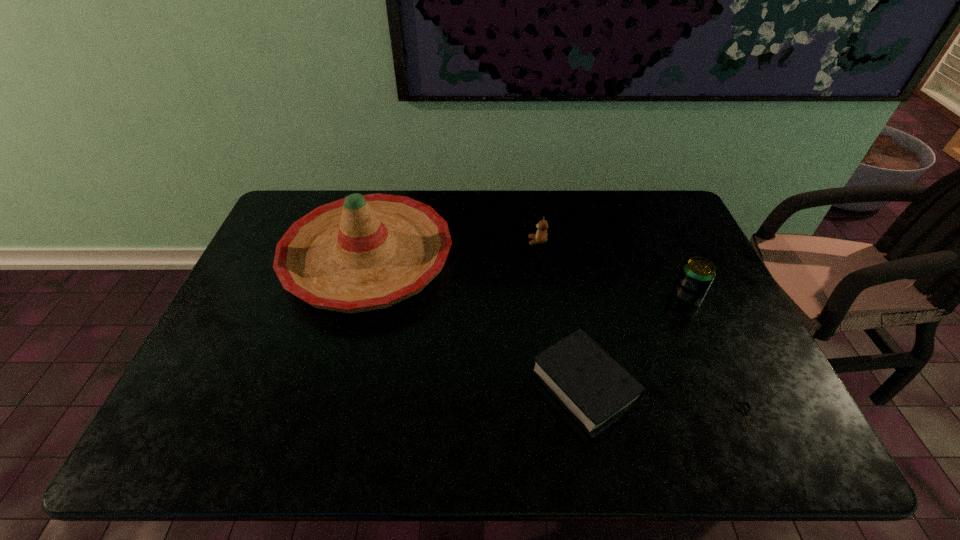
The height and width of the screenshot is (540, 960). I want to click on object that is at the near right corner, so click(x=745, y=411).

In the image, there is a desktop. Where is `vacant space at the far edge`? vacant space at the far edge is located at coordinates (566, 233).

This screenshot has width=960, height=540. In order to click on vacant space at the near edge in this screenshot , I will do `click(412, 428)`.

At what (x,y) coordinates should I click in order to perform the action: click on vacant area at the left edge of the desktop. Please return your answer as a coordinate pair (x, y). The width and height of the screenshot is (960, 540). Looking at the image, I should click on (276, 325).

This screenshot has width=960, height=540. In the image, there is a desktop. Find the location of `free space at the right edge`. free space at the right edge is located at coordinates (x=659, y=268).

The height and width of the screenshot is (540, 960). Identify the location of vacant space at the far left corner of the desktop. (300, 199).

Locate an element on the screen. This screenshot has height=540, width=960. vacant area at the far right corner of the desktop is located at coordinates (636, 221).

Locate an element on the screen. Image resolution: width=960 pixels, height=540 pixels. vacant space at the near right corner is located at coordinates [x=739, y=427].

The width and height of the screenshot is (960, 540). In order to click on empty space between the third shortest object and the fourth tallest object in this screenshot , I will do `click(562, 314)`.

Find the location of `empty space between the fourth tallest object and the leftmost object`. empty space between the fourth tallest object and the leftmost object is located at coordinates (476, 322).